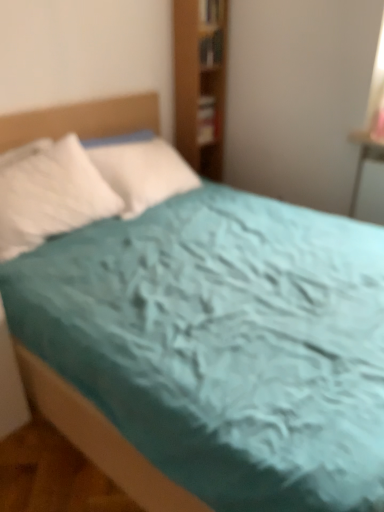
The width and height of the screenshot is (384, 512). What do you see at coordinates (211, 49) in the screenshot?
I see `wooden bookshelf at upper center` at bounding box center [211, 49].

Where is `wooden bookshelf at upper center`? The image size is (384, 512). wooden bookshelf at upper center is located at coordinates (211, 49).

What is the approximate width of wooden bookshelf at upper center?

The width of wooden bookshelf at upper center is 5.10 inches.

You are a GUI agent. You are given a task and a screenshot of the screen. Output one action in this format:
    pyautogui.click(x=<x>, y=<y>)
    Task: Click on the wooden bookshelf at upper center
    
    Given the screenshot: What is the action you would take?
    pyautogui.click(x=211, y=49)